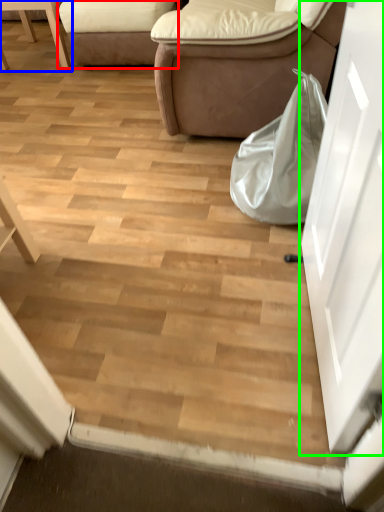
Question: Which object is positioned closest to studio couch (highlighted by a red box)? Select from furniture (highlighted by a blue box) and door (highlighted by a green box).

Choices:
 (A) furniture
 (B) door

Answer: (A)